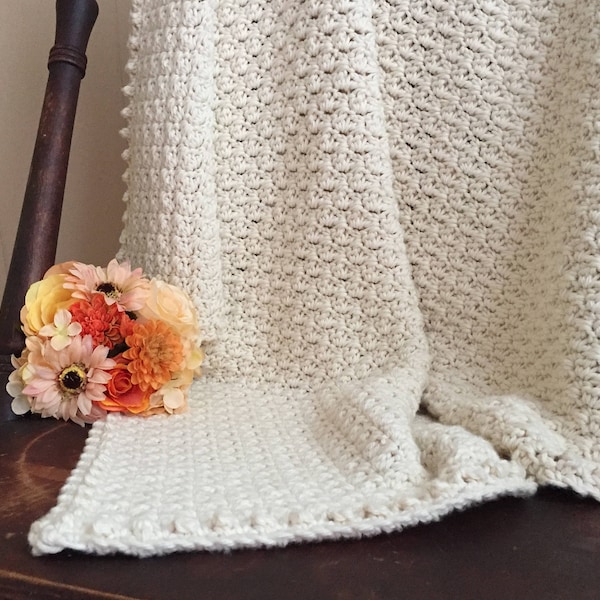
Where is `seat`? seat is located at coordinates (27, 440).